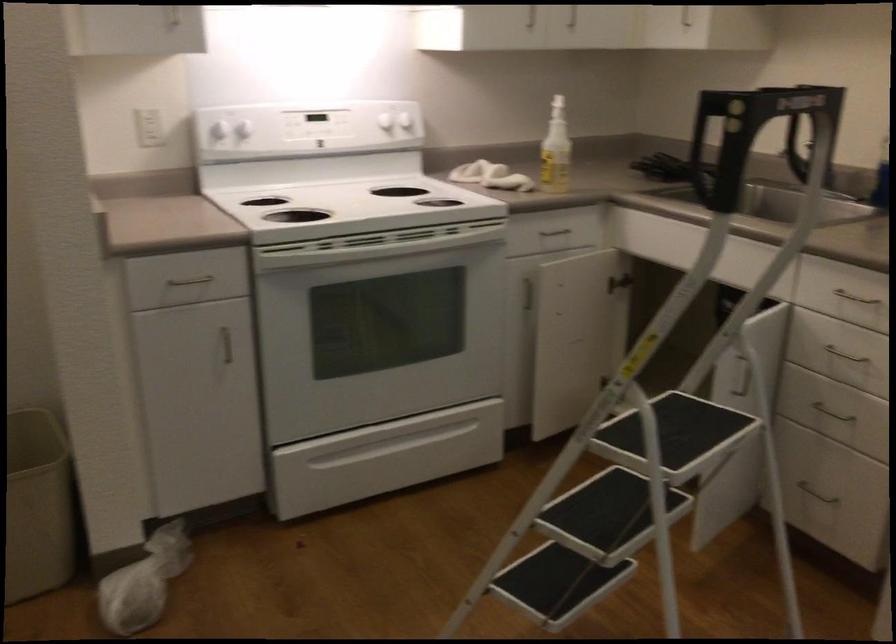
Find the location of a particular element. The image size is (896, 644). white power outlet is located at coordinates (149, 126).